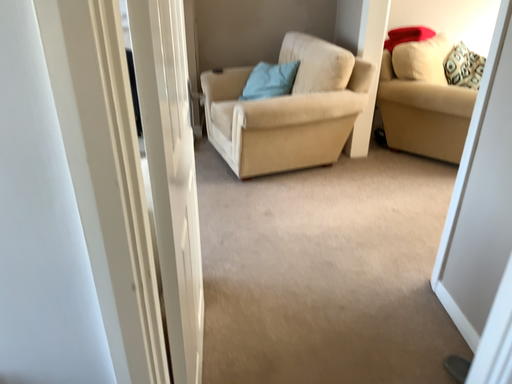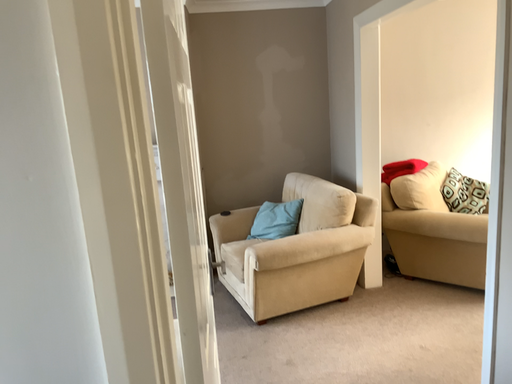
Question: Which way did the camera rotate in the video?

Choices:
 (A) rotated upward
 (B) rotated downward

Answer: (A)